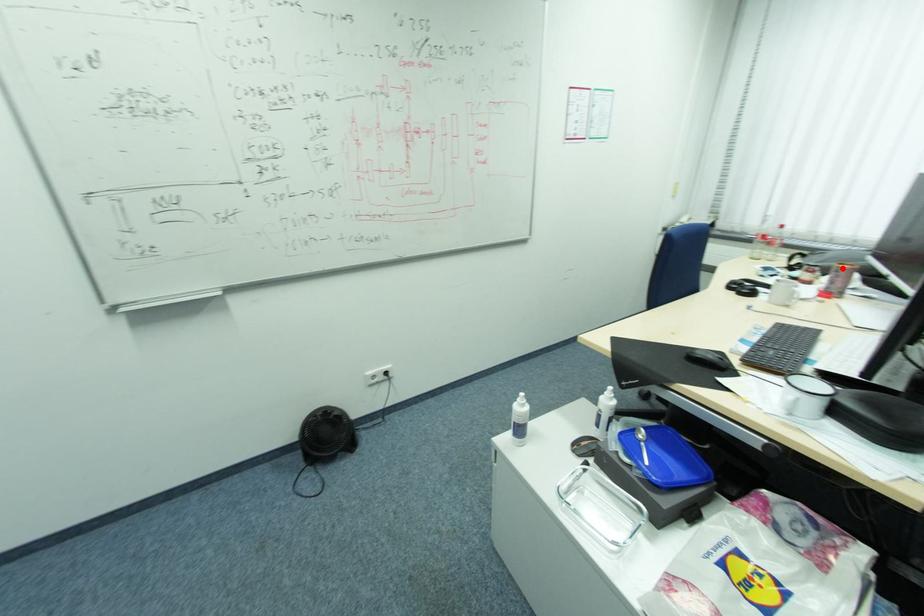
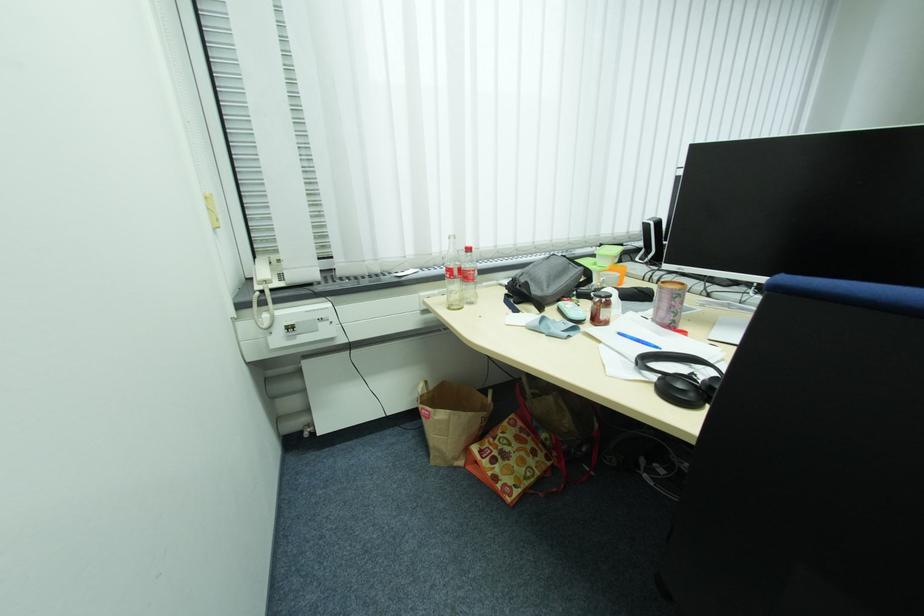
In the second image, find the point that corresponds to the highlighted location in the first image.

(687, 290)